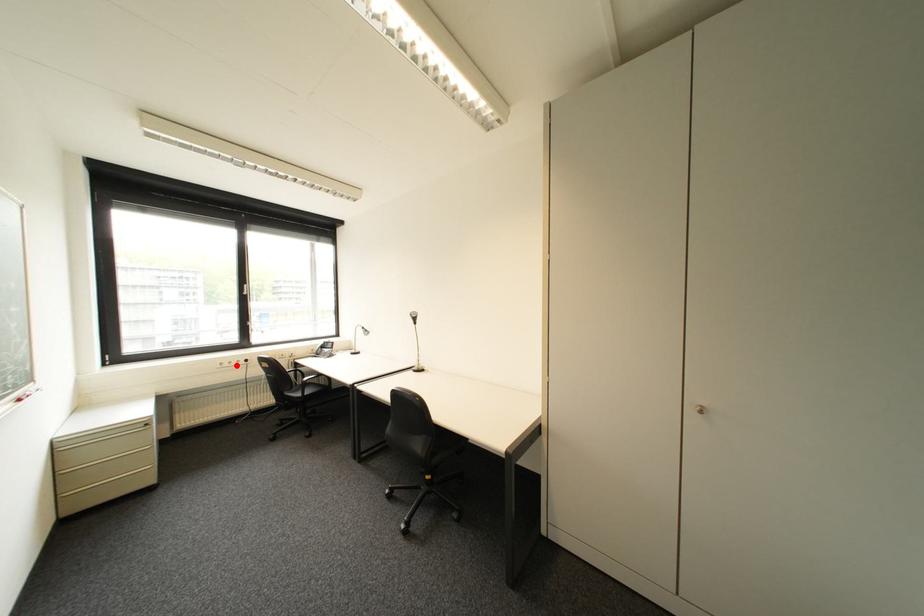
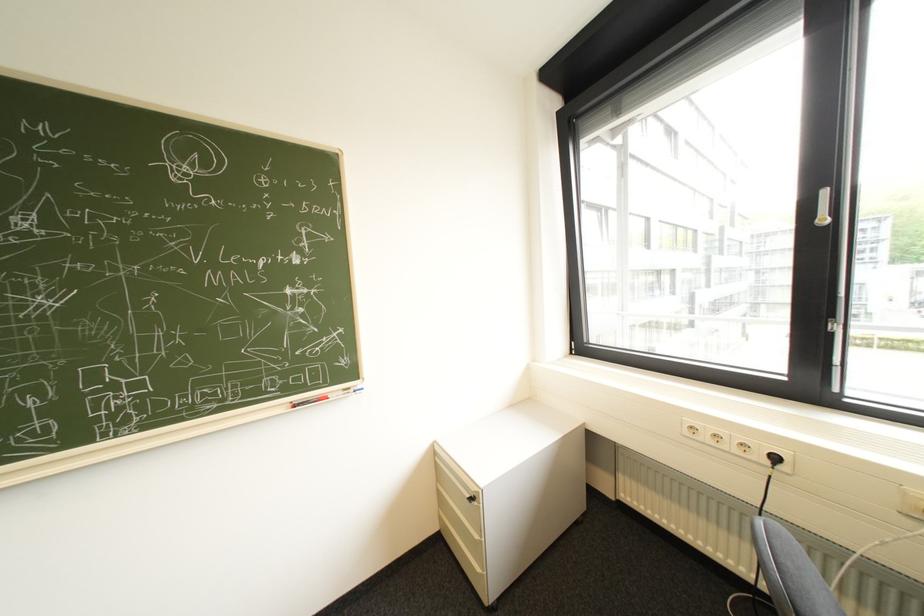
Question: I am providing you with two images of the same scene from different viewpoints. Image1 has a red point marked. In image2, the corresponding 3D location appears at what relative position? Reply with the corresponding letter.

Choices:
 (A) Closer
 (B) Farther

Answer: (A)